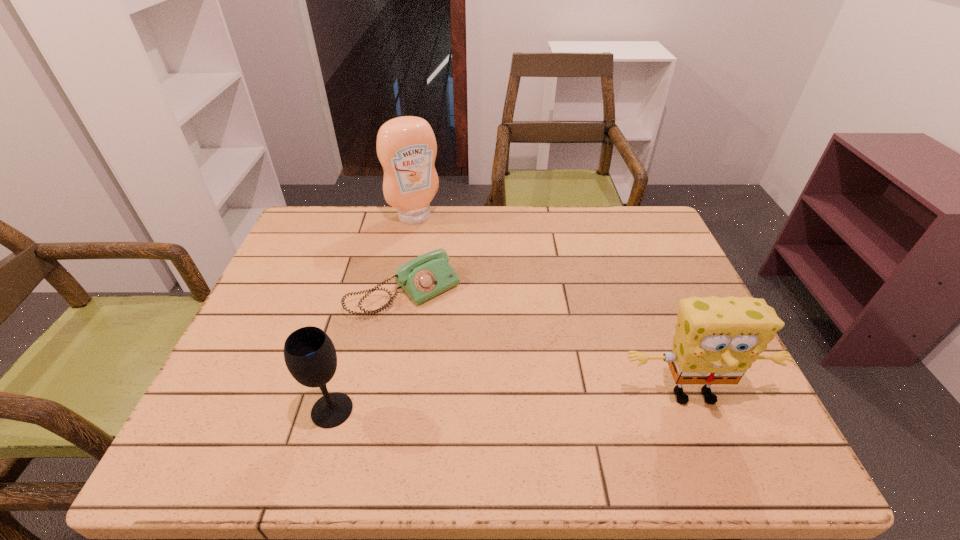
Image resolution: width=960 pixels, height=540 pixels. What are the coordinates of `vacant space at the far left corner of the desktop` in the screenshot? It's located at (337, 218).

I want to click on vacant space at the far right corner, so click(x=632, y=247).

The image size is (960, 540). I want to click on vacant space at the near right corner of the desktop, so click(727, 415).

You are a GUI agent. You are given a task and a screenshot of the screen. Output one action in this format:
    pyautogui.click(x=<x>, y=<y>)
    Task: Click on the free space between the third nearest object and the sponge
    This screenshot has width=960, height=540.
    Given the screenshot: What is the action you would take?
    pyautogui.click(x=549, y=343)

At what (x,y) coordinates should I click in order to perform the action: click on blank region between the condiment and the second farthest object. Please return your answer as a coordinate pair (x, y). The image size is (960, 540). Looking at the image, I should click on (410, 254).

At what (x,y) coordinates should I click in order to perform the action: click on vacant space in between the telephone and the sponge. Please return your answer as a coordinate pair (x, y). Image resolution: width=960 pixels, height=540 pixels. Looking at the image, I should click on (549, 343).

Find the location of a particular element. The width and height of the screenshot is (960, 540). vacant space in between the third nearest object and the sponge is located at coordinates (549, 343).

The image size is (960, 540). I want to click on free space between the wineglass and the second farthest object, so click(x=369, y=350).

The image size is (960, 540). In order to click on free space between the wineglass and the sponge in this screenshot , I will do `click(513, 402)`.

Where is `vacant space in between the rightmost object and the farthest object`? vacant space in between the rightmost object and the farthest object is located at coordinates (554, 306).